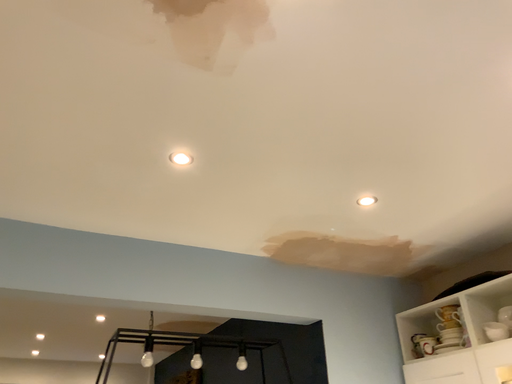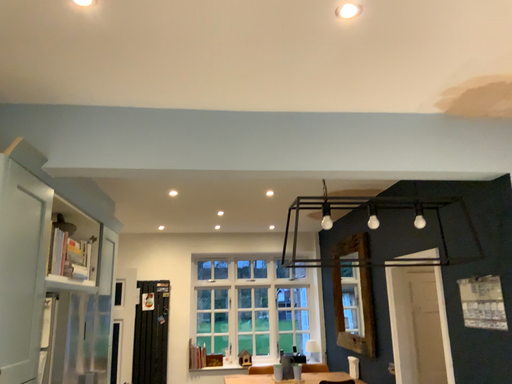
Question: Which way did the camera rotate in the video?

Choices:
 (A) rotated upward
 (B) rotated downward

Answer: (B)